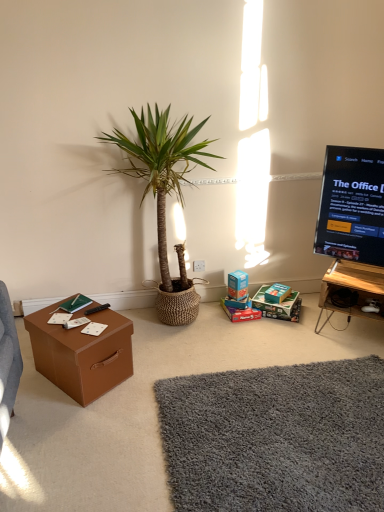
Where is `vacant area that lies between green woven pot at center and matte cardboard box at lower center, the 1th storage box viewed from the left`? The width and height of the screenshot is (384, 512). vacant area that lies between green woven pot at center and matte cardboard box at lower center, the 1th storage box viewed from the left is located at coordinates (228, 324).